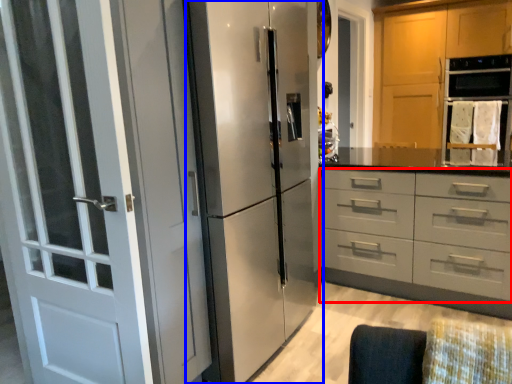
Question: Which object appears closest to the camera in this image, drawer (highlighted by a red box) or refrigerator (highlighted by a blue box)?

Choices:
 (A) drawer
 (B) refrigerator

Answer: (B)